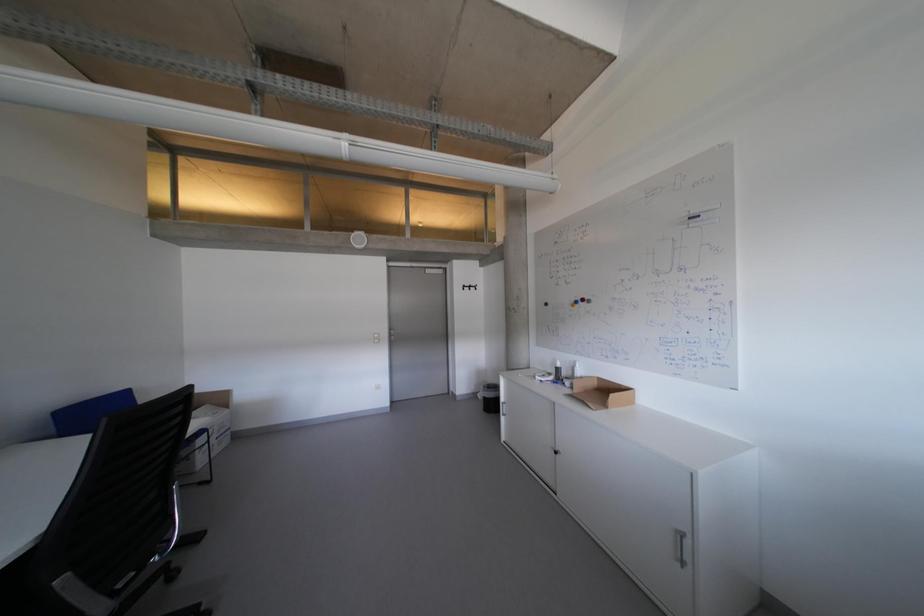
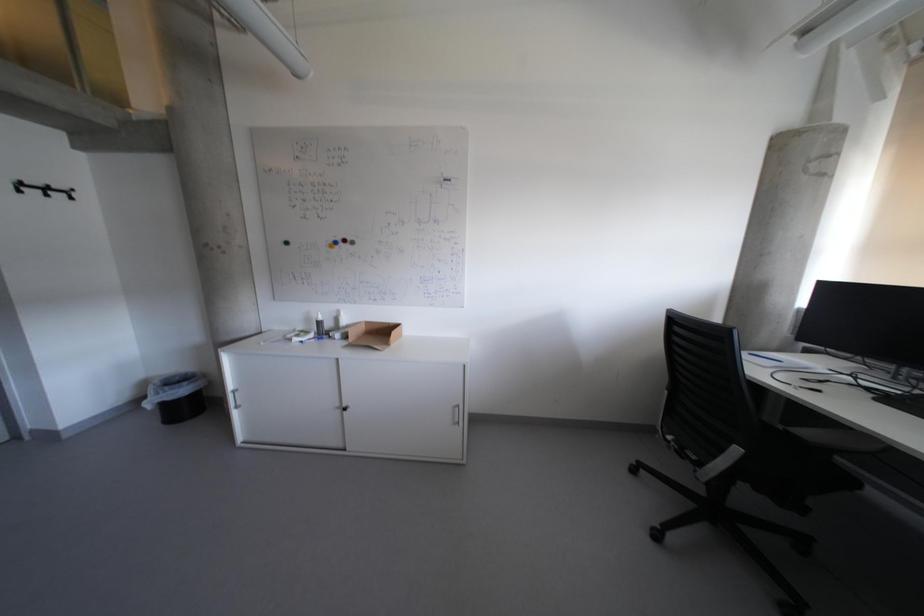
Question: The images are taken continuously from a first-person perspective. In which direction is your viewpoint rotating?

Choices:
 (A) Left
 (B) Right
 (C) Up
 (D) Down

Answer: (B)